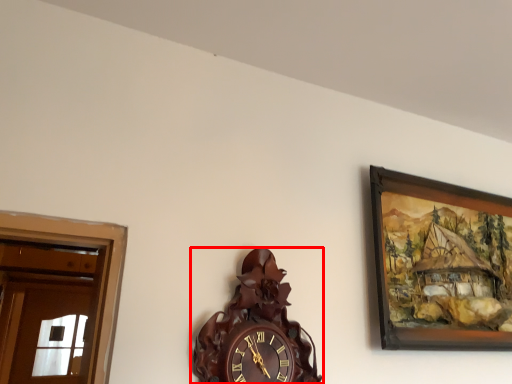
Question: From the image's perspective, where is wall clock (annotated by the red box) located relative to picture frame?

Choices:
 (A) above
 (B) below

Answer: (B)